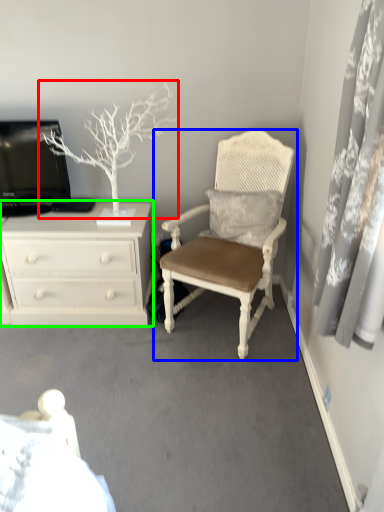
Question: Which object is positioned farthest from tree (highlighted by a red box)? Select from chair (highlighted by a blue box) and chest of drawers (highlighted by a green box).

Choices:
 (A) chair
 (B) chest of drawers

Answer: (A)